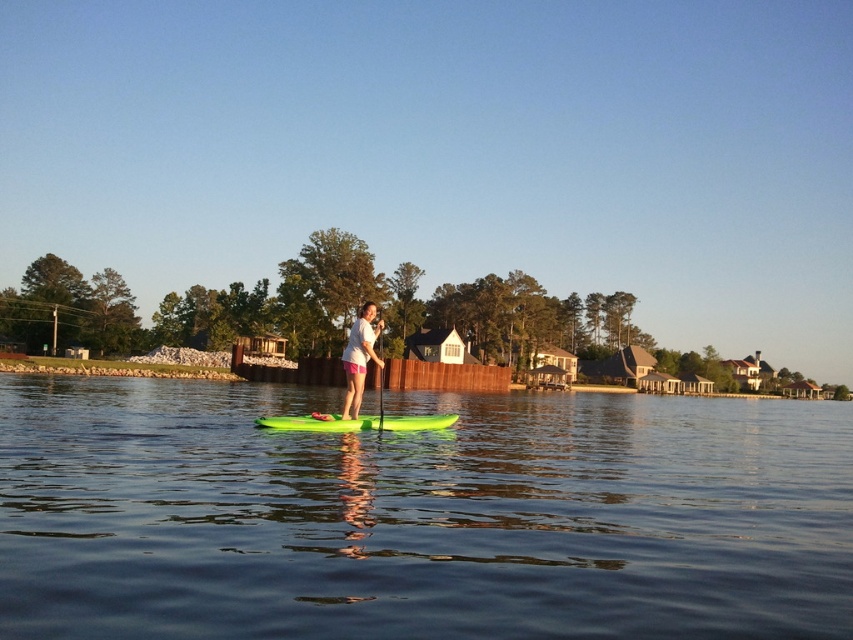
You are navigating a small boat from the wooden fence towards the person on the paddleboard. The wooden fence is at point (381, 394) and the person is at point (373, 420). Which point should you steer towards first to reach the person efficiently?

You should steer towards point (373, 420) first because it is behind point (381, 394), meaning it is farther away from the starting position. By heading directly to the person at point (373, 420), you can reach them without needing to adjust course.

You are a photographer trying to capture the person on the paddleboard. You need to decide which object, the white matte shirt at center or the green rubber paddle at center, will appear narrower in your photo. Which one should you focus on for a tighter composition?

The white matte shirt at center is thinner than the green rubber paddle at center, so focusing on the white matte shirt at center will allow for a tighter composition since it is narrower.